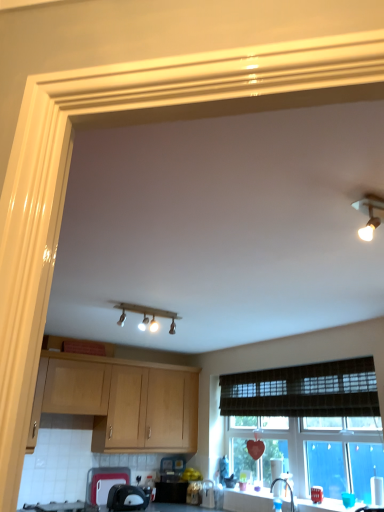
Locate an element on the screen. empty space that is ontop of matte wood light fixture at upper center (from a real-world perspective) is located at coordinates (160, 307).